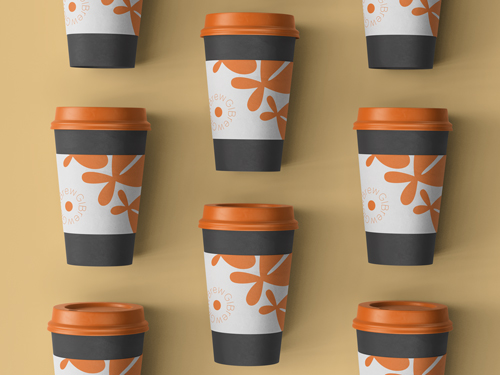
I want to click on decerative coffee cup, so click(x=111, y=38), click(x=245, y=85), click(x=415, y=17), click(x=84, y=180), click(x=244, y=267), click(x=401, y=213), click(x=97, y=358), click(x=390, y=355).